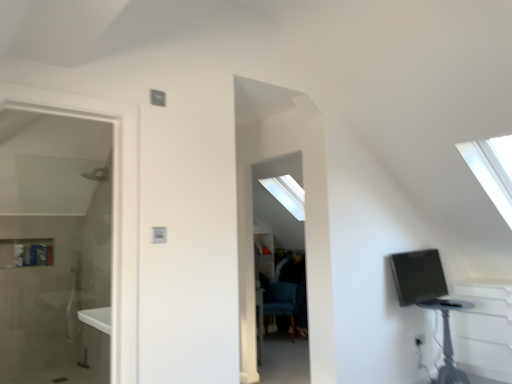
Measure the distance between black plastic table at lower right and camera.

black plastic table at lower right is 3.63 meters away from camera.

In order to click on blue fabric swivel chair at center in this screenshot , I will do `click(280, 302)`.

Is matte black monitor at right inside black plastic table at lower right?

Definitely not — matte black monitor at right is not inside black plastic table at lower right.

Is black plastic table at lower right smaller than matte black monitor at right?

Actually, black plastic table at lower right might be larger than matte black monitor at right.

The height and width of the screenshot is (384, 512). What are the coordinates of `table that appears below the matte black monitor at right (from a real-world perspective)` in the screenshot? It's located at (446, 339).

Is blue fabric swivel chair at center a part of black plastic table at lower right?

No, black plastic table at lower right does not contain blue fabric swivel chair at center.

Based on the photo, from a real-world perspective, is black plastic table at lower right positioned above or below blue fabric swivel chair at center?

black plastic table at lower right is situated higher than blue fabric swivel chair at center in the real world.

Which object is positioned more to the right, black plastic table at lower right or blue fabric swivel chair at center?

Positioned to the right is black plastic table at lower right.

Which of these two, matte black monitor at right or black plastic table at lower right, is thinner?

matte black monitor at right.

In terms of height, does matte black monitor at right look taller or shorter compared to black plastic table at lower right?

matte black monitor at right is shorter than black plastic table at lower right.

Consider the image. Is black plastic table at lower right located within matte black monitor at right?

No, black plastic table at lower right is not inside matte black monitor at right.

Is matte black monitor at right further to the viewer compared to blue fabric swivel chair at center?

No, it is not.

Is matte black monitor at right far away from blue fabric swivel chair at center?

Yes, matte black monitor at right and blue fabric swivel chair at center are located far from each other.

Can you confirm if matte black monitor at right is smaller than blue fabric swivel chair at center?

Correct, matte black monitor at right occupies less space than blue fabric swivel chair at center.

How distant is matte black monitor at right from blue fabric swivel chair at center?

matte black monitor at right is 3.52 meters away from blue fabric swivel chair at center.

Choose the correct answer: Is blue fabric swivel chair at center inside black plastic table at lower right or outside it?

blue fabric swivel chair at center is located beyond the bounds of black plastic table at lower right.

From a real-world perspective, is blue fabric swivel chair at center positioned under black plastic table at lower right based on gravity?

Indeed, from a real-world perspective, blue fabric swivel chair at center is positioned beneath black plastic table at lower right.

Find the location of `swivel chair to the left of black plastic table at lower right`. swivel chair to the left of black plastic table at lower right is located at coordinates (280, 302).

In terms of height, does blue fabric swivel chair at center look taller or shorter compared to black plastic table at lower right?

In the image, blue fabric swivel chair at center appears to be shorter than black plastic table at lower right.

Which is more to the right, blue fabric swivel chair at center or matte black monitor at right?

matte black monitor at right is more to the right.

Considering the relative positions of blue fabric swivel chair at center and matte black monitor at right in the image provided, is blue fabric swivel chair at center behind matte black monitor at right?

Yes, blue fabric swivel chair at center is further from the viewer.

In the scene shown: Between blue fabric swivel chair at center and matte black monitor at right, which one has less height?

matte black monitor at right.

Based on the photo, can you confirm if blue fabric swivel chair at center is wider than matte black monitor at right?

Yes, blue fabric swivel chair at center is wider than matte black monitor at right.

Identify the location of computer located on the left of black plastic table at lower right. This screenshot has width=512, height=384. (418, 276).

Identify the location of table located above the blue fabric swivel chair at center (from a real-world perspective). (446, 339).

Based on their spatial positions, is matte black monitor at right or blue fabric swivel chair at center further from black plastic table at lower right?

blue fabric swivel chair at center is further to black plastic table at lower right.

Which object lies nearer to the anchor point matte black monitor at right, blue fabric swivel chair at center or black plastic table at lower right?

The object closer to matte black monitor at right is black plastic table at lower right.

Which object lies further to the anchor point black plastic table at lower right, blue fabric swivel chair at center or matte black monitor at right?

blue fabric swivel chair at center is further to black plastic table at lower right.

Based on their spatial positions, is matte black monitor at right or black plastic table at lower right closer to blue fabric swivel chair at center?

black plastic table at lower right.

Based on their spatial positions, is black plastic table at lower right or blue fabric swivel chair at center further from matte black monitor at right?

blue fabric swivel chair at center is further to matte black monitor at right.

Looking at the image, which one is located further to blue fabric swivel chair at center, black plastic table at lower right or matte black monitor at right?

matte black monitor at right lies further to blue fabric swivel chair at center than the other object.

I want to click on computer between black plastic table at lower right and blue fabric swivel chair at center in the front-back direction, so click(x=418, y=276).